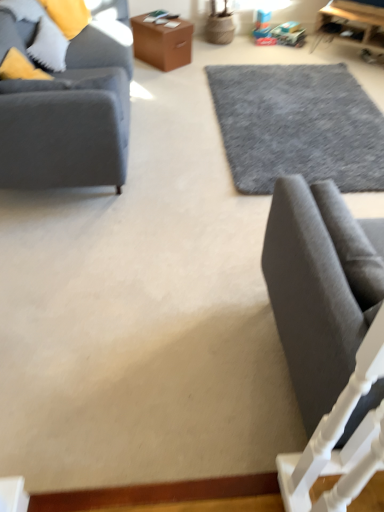
Question: Which direction should I rotate to look at brown leather box at upper center, which is the second table from right to left, — up or down?

Choices:
 (A) up
 (B) down

Answer: (A)

Question: Is the depth of dark gray fabric studio couch at lower right, which is counted as the second studio couch, starting from the top, less than that of wooden table at upper right, marked as the second table in a left-to-right arrangement?

Choices:
 (A) yes
 (B) no

Answer: (A)

Question: Does dark gray fabric studio couch at lower right, which is counted as the second studio couch, starting from the left, have a larger size compared to wooden table at upper right, marked as the second table in a left-to-right arrangement?

Choices:
 (A) no
 (B) yes

Answer: (A)

Question: From the image's perspective, is dark gray fabric studio couch at lower right, the 1th studio couch positioned from the front, beneath wooden table at upper right, marked as the second table in a left-to-right arrangement?

Choices:
 (A) no
 (B) yes

Answer: (B)

Question: From a real-world perspective, is dark gray fabric studio couch at lower right, which appears as the first studio couch when ordered from the bottom, over wooden table at upper right, acting as the 1th table starting from the right?

Choices:
 (A) yes
 (B) no

Answer: (A)

Question: Can you confirm if dark gray fabric studio couch at lower right, which is counted as the second studio couch, starting from the left, is thinner than wooden table at upper right, acting as the 1th table starting from the right?

Choices:
 (A) yes
 (B) no

Answer: (A)

Question: Does dark gray fabric studio couch at lower right, placed as the 1th studio couch when sorted from right to left, turn towards wooden table at upper right, acting as the 1th table starting from the right?

Choices:
 (A) no
 (B) yes

Answer: (A)

Question: From the image's perspective, is gray wool rug at center below dark gray fabric studio couch at lower right, which appears as the first studio couch when ordered from the bottom?

Choices:
 (A) yes
 (B) no

Answer: (B)

Question: Is gray wool rug at center wider than dark gray fabric studio couch at lower right, which is counted as the second studio couch, starting from the top?

Choices:
 (A) yes
 (B) no

Answer: (A)

Question: Are gray wool rug at center and dark gray fabric studio couch at lower right, the 1th studio couch positioned from the front, located far from each other?

Choices:
 (A) no
 (B) yes

Answer: (B)

Question: Considering the relative sizes of gray wool rug at center and dark gray fabric studio couch at lower right, placed as the 1th studio couch when sorted from right to left, in the image provided, is gray wool rug at center thinner than dark gray fabric studio couch at lower right, placed as the 1th studio couch when sorted from right to left,?

Choices:
 (A) no
 (B) yes

Answer: (A)

Question: Can you confirm if gray wool rug at center is bigger than dark gray fabric studio couch at lower right, which is counted as the second studio couch, starting from the top?

Choices:
 (A) no
 (B) yes

Answer: (B)

Question: Can you confirm if gray wool rug at center is taller than dark gray fabric studio couch at lower right, which appears as the first studio couch when ordered from the bottom?

Choices:
 (A) no
 (B) yes

Answer: (A)

Question: Is matte gray fabric couch at left, the 2th studio couch in the bottom-to-top sequence, not close to wooden table at upper right, acting as the 1th table starting from the right?

Choices:
 (A) no
 (B) yes

Answer: (B)